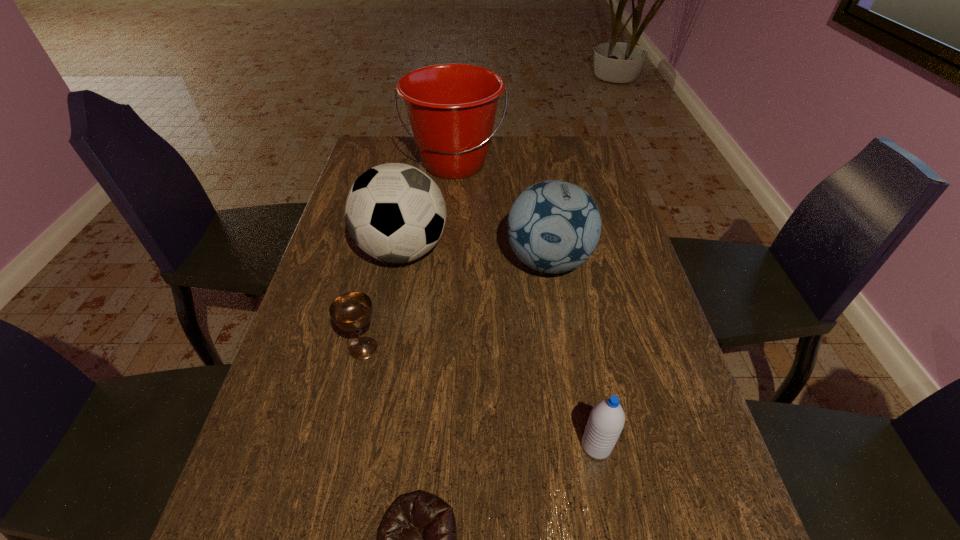
Locate an element on the screen. The width and height of the screenshot is (960, 540). vacant space located 0.200m on the back of the fourth tallest object is located at coordinates (577, 346).

This screenshot has width=960, height=540. What are the coordinates of `vacant area located on the right of the chalice` in the screenshot? It's located at (454, 348).

At what (x,y) coordinates should I click in order to perform the action: click on object at the far edge. Please return your answer as a coordinate pair (x, y). Looking at the image, I should click on (451, 107).

Find the location of `bucket situated at the left edge`. bucket situated at the left edge is located at coordinates (451, 107).

The height and width of the screenshot is (540, 960). I want to click on soccer ball that is at the left edge, so click(x=394, y=212).

Image resolution: width=960 pixels, height=540 pixels. I want to click on chalice at the left edge, so click(351, 311).

I want to click on object that is at the right edge, so click(554, 226).

At what (x,y) coordinates should I click in order to perform the action: click on object situated at the far left corner. Please return your answer as a coordinate pair (x, y). This screenshot has width=960, height=540. Looking at the image, I should click on (451, 107).

Find the location of `free space at the far edge`. free space at the far edge is located at coordinates (495, 139).

This screenshot has height=540, width=960. Identify the location of free space at the left edge of the desktop. (310, 308).